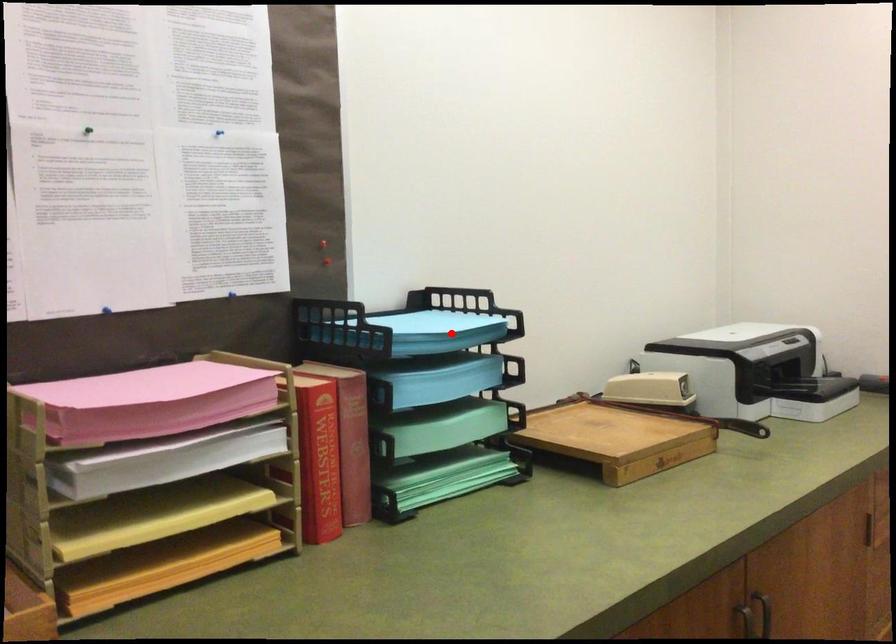
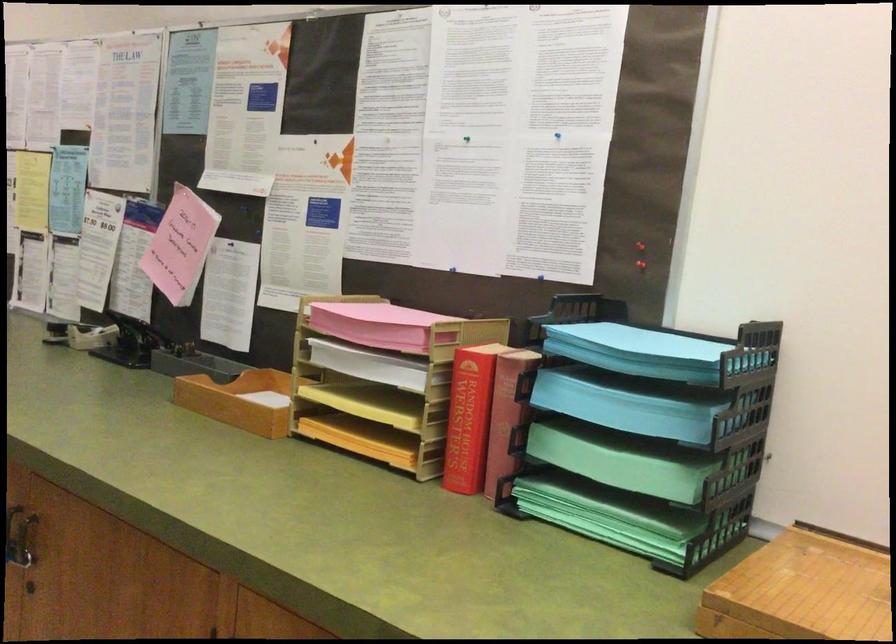
In the second image, find the point that corresponds to the highlighted location in the first image.

(640, 352)